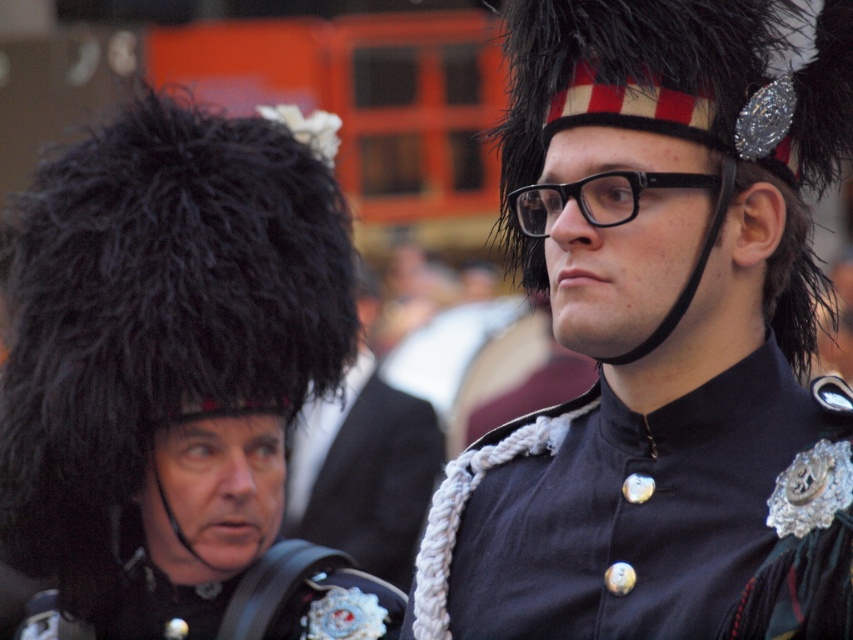
Between shiny black hat at center and black fuzzy hat at left, which one appears on the right side from the viewer's perspective?

shiny black hat at center is more to the right.

Which is behind, point (558, 266) or point (267, 536)?

Point (267, 536)

Does point (809, 593) come in front of point (111, 173)?

Yes, it is.

Where is `shiny black hat at center`? The width and height of the screenshot is (853, 640). shiny black hat at center is located at coordinates (660, 339).

Does shiny black hat at center lie behind black fabric uniform at center?

Yes, it is.

Can you confirm if shiny black hat at center is bigger than black fabric uniform at center?

Yes, shiny black hat at center is bigger than black fabric uniform at center.

Image resolution: width=853 pixels, height=640 pixels. Identify the location of shiny black hat at center. (660, 339).

In the scene shown: Which is above, shiny black hat at center or white corduroy sash at center?

Positioned higher is shiny black hat at center.

Does shiny black hat at center have a lesser width compared to white corduroy sash at center?

No.

Is point (451, 493) farther from viewer compared to point (351, 438)?

That is False.

Locate an element on the screen. The image size is (853, 640). shiny black hat at center is located at coordinates (660, 339).